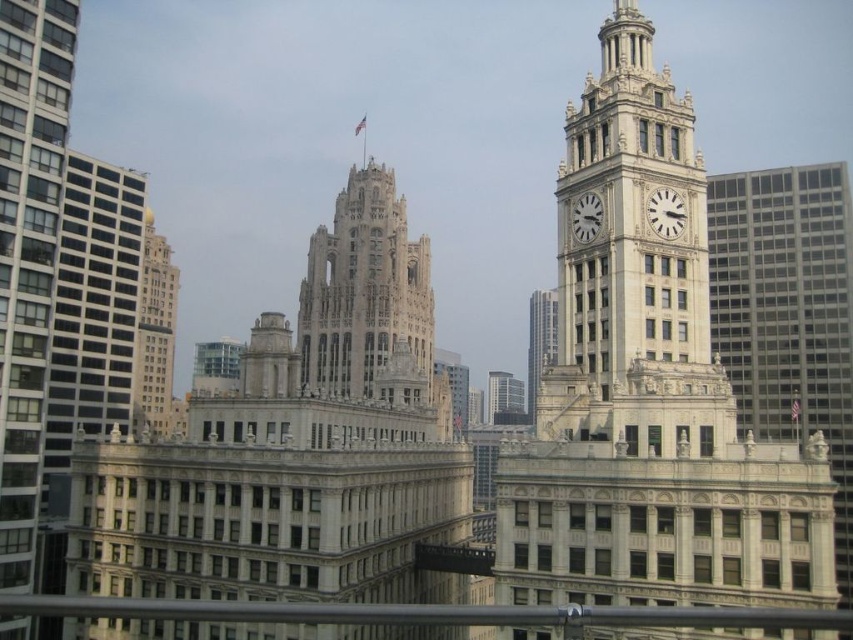
Question: Which point is closer to the camera?

Choices:
 (A) white stone clock at upper right
 (B) white stone clock tower at center

Answer: (B)

Question: Which of these objects is positioned farthest from the white stone tower at center?

Choices:
 (A) white marble clock at upper right
 (B) white glass skyscraper at center
 (C) white stone tower at upper center

Answer: (A)

Question: Is white stone clock tower at upper right wider than white glass skyscraper at center?

Choices:
 (A) yes
 (B) no

Answer: (A)

Question: Is white stone clock tower at upper right to the left of white stone clock at upper right from the viewer's perspective?

Choices:
 (A) no
 (B) yes

Answer: (B)

Question: Does light beige stone tower at center have a greater width compared to white marble clock at upper right?

Choices:
 (A) no
 (B) yes

Answer: (B)

Question: Among these objects, which one is farthest from the camera?

Choices:
 (A) light beige stone tower at center
 (B) white marble clock at upper right
 (C) white stone clock tower at center
 (D) gold polished tower at upper left

Answer: (A)